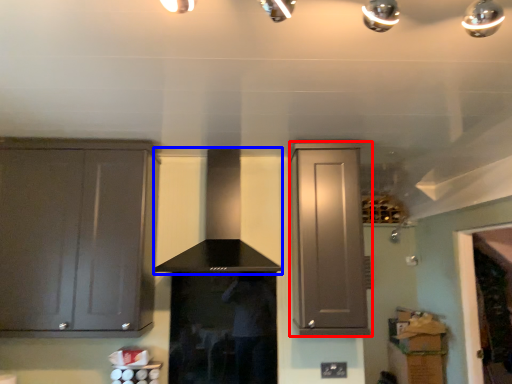
Question: Which object is further to the camera taking this photo, cabinetry (highlighted by a red box) or vent (highlighted by a blue box)?

Choices:
 (A) cabinetry
 (B) vent

Answer: (A)